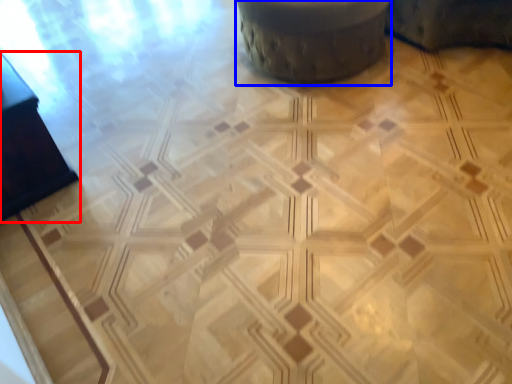
Question: Which point is further to the camera, furniture (highlighted by a red box) or swivel chair (highlighted by a blue box)?

Choices:
 (A) furniture
 (B) swivel chair

Answer: (B)